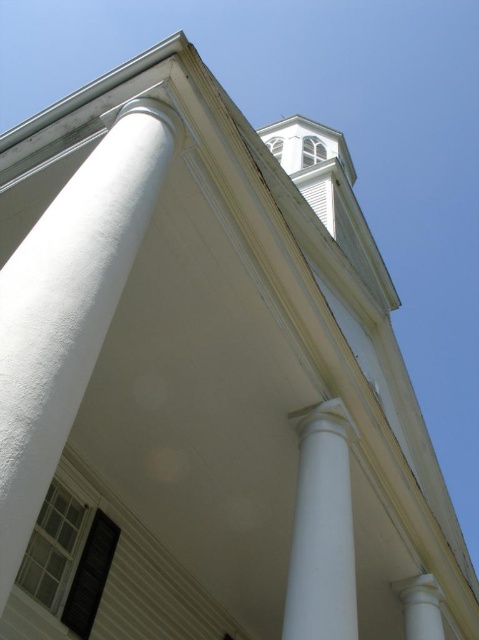
You are an architect assessing the structural integrity of the white building. You notice two columns supporting the roofline. Which column has a smaller diameter? The columns are labeled as white smooth column at left and white smooth column at lower right.

The white smooth column at left has a lesser width compared to the white smooth column at lower right, so it has a smaller diameter.

Looking at this image, you are standing in front of the white building and want to take a photo of both the white smooth column at left and the white smooth column at lower right. Which column should you position closer to the left side of your camera frame to include both in the photo?

You should position the white smooth column at left closer to the left side of your camera frame since it is already on the left side of the white smooth column at lower right, ensuring both columns are captured in the photo.